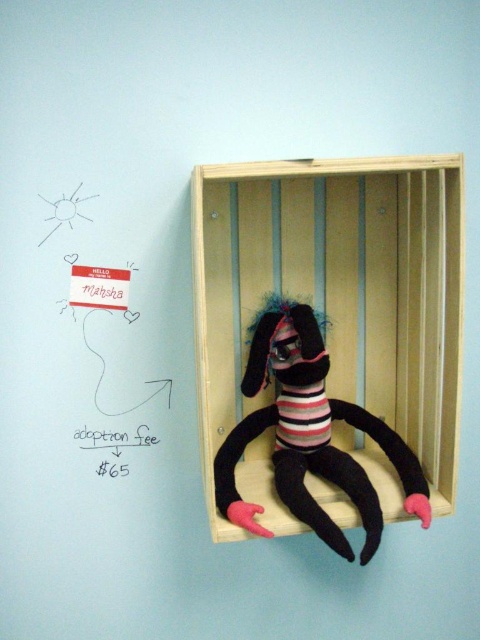
You are a customer looking at the striped fabric plush toy at center and the black paper adoption fee at center displayed on the wall. Which item is taller?

The striped fabric plush toy at center is taller than the black paper adoption fee at center.

Consider the image. You are a customer looking at the wall display. You see the striped fabric plush toy at center and the black paper adoption fee at center. Which one is positioned more to the right?

The striped fabric plush toy at center is positioned more to the right than the black paper adoption fee at center.

You are a cat trying to reach the striped fabric plush toy at center while sitting on the wooden crate at center. Can you stretch your paw to touch it?

The wooden crate at center and striped fabric plush toy at center are 9.31 centimeters apart from each other. Since cats can typically stretch their paws about 10 centimeters beyond their body, you should be able to reach the striped fabric plush toy at center while sitting on the wooden crate at center.